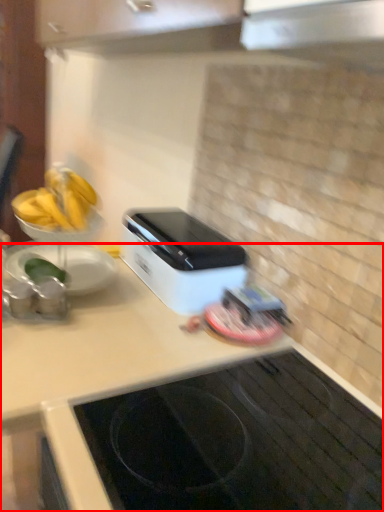
Question: From the image's perspective, what is the correct spatial positioning of countertop (annotated by the red box) in reference to home appliance?

Choices:
 (A) below
 (B) above

Answer: (A)